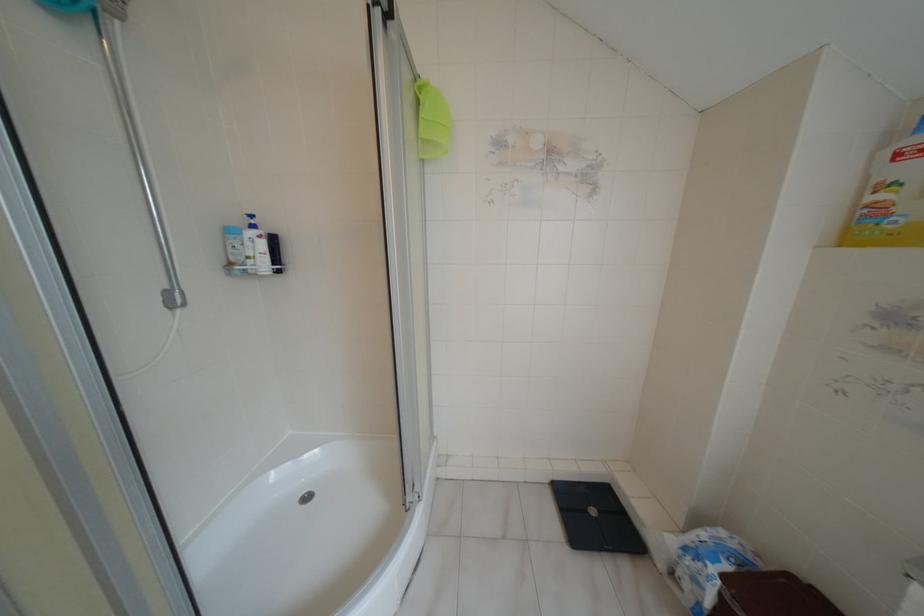
Describe the element at coordinates (174, 299) in the screenshot. I see `the shower height adjuster` at that location.